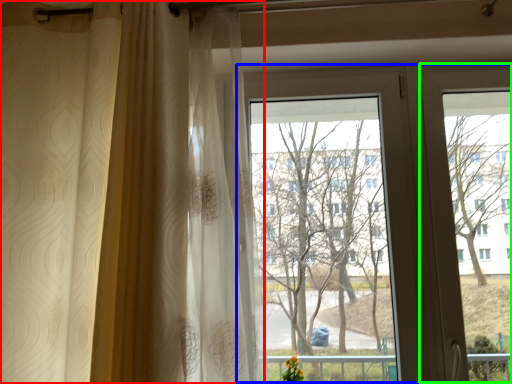
Question: Which object is the farthest from curtain (highlighted by a red box)? Choose among these: bay window (highlighted by a blue box) or screen door (highlighted by a green box).

Choices:
 (A) bay window
 (B) screen door

Answer: (B)